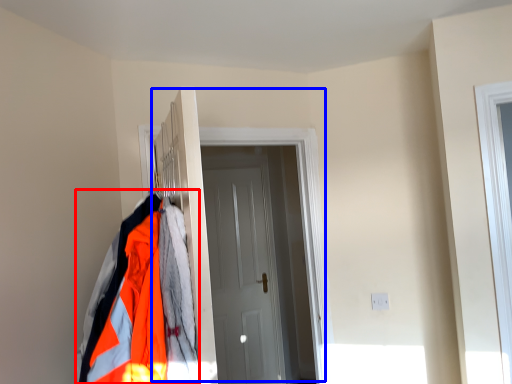
Question: Which object appears farthest to the camera in this image, jacket (highlighted by a red box) or door (highlighted by a blue box)?

Choices:
 (A) jacket
 (B) door

Answer: (B)